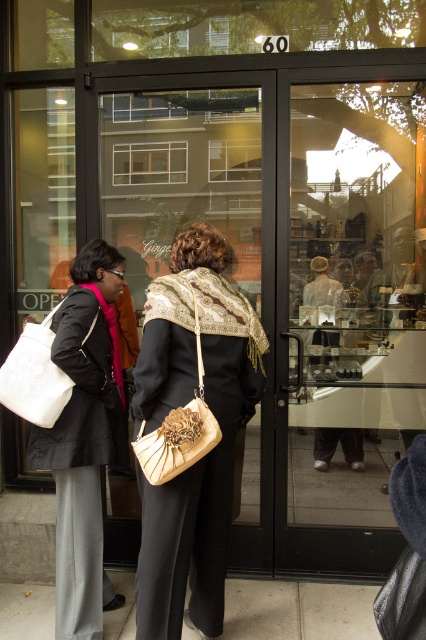
Question: Can you confirm if transparent glass door at center is wider than gold textured purse at center?

Choices:
 (A) yes
 (B) no

Answer: (A)

Question: Can you confirm if matte gold purse at center is bigger than gold textured purse at center?

Choices:
 (A) no
 (B) yes

Answer: (B)

Question: Which point is farther to the camera?

Choices:
 (A) gold textured purse at center
 (B) transparent glass door at center

Answer: (B)

Question: Which point is closer to the camera?

Choices:
 (A) matte black jacket at left
 (B) white woven tote at left
 (C) matte gold purse at center

Answer: (C)

Question: Estimate the real-world distances between objects in this image. Which object is farther from the transparent glass door at center?

Choices:
 (A) matte gold purse at center
 (B) gold textured purse at center
 (C) matte black jacket at left
 (D) white woven tote at left

Answer: (D)

Question: Can you confirm if white woven tote at left is positioned below gold textured purse at center?

Choices:
 (A) yes
 (B) no

Answer: (B)